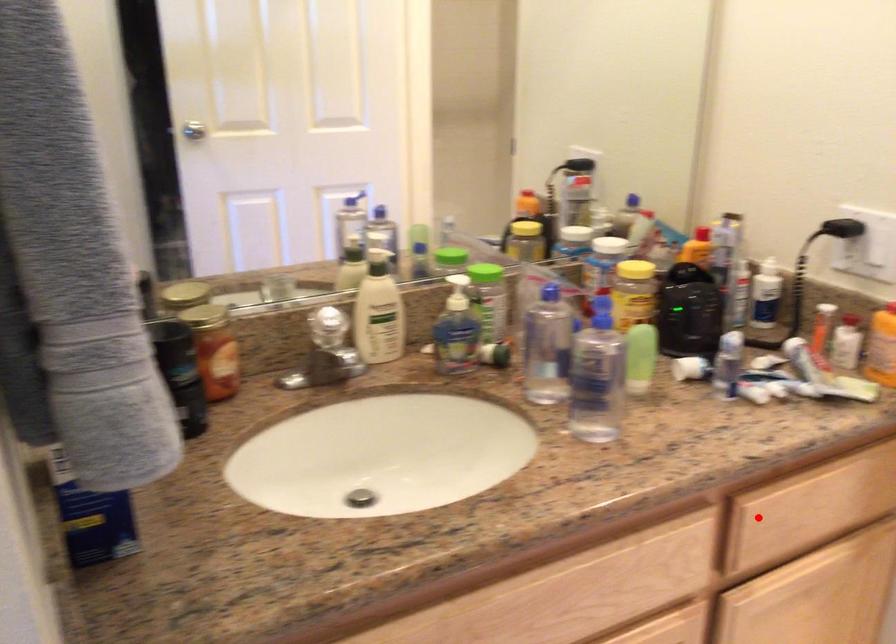
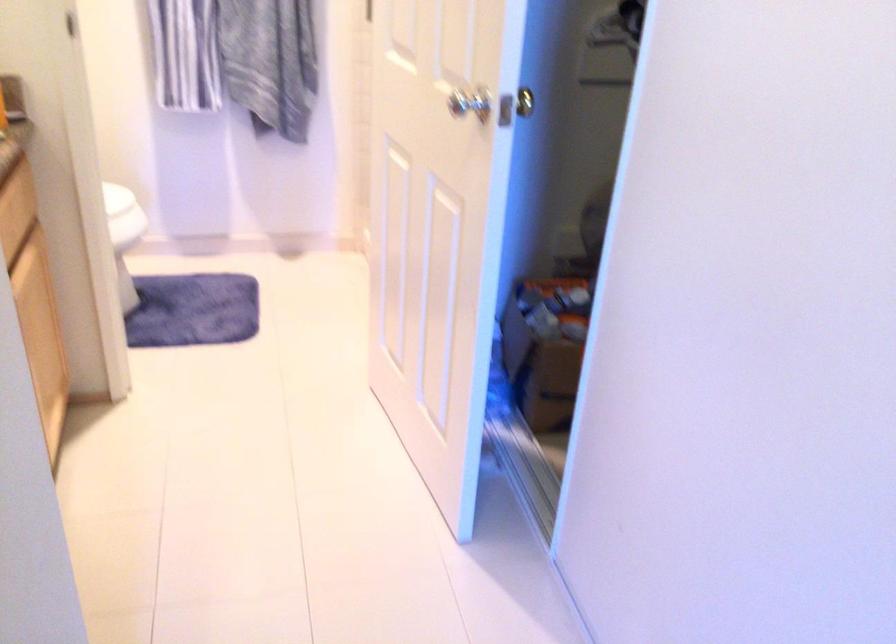
In the second image, find the point that corresponds to the highlighted location in the first image.

(12, 229)